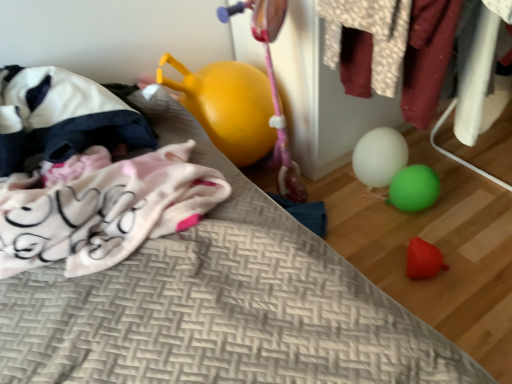
Describe the element at coordinates (61, 117) in the screenshot. This screenshot has width=512, height=384. I see `white fabric bean bag at left` at that location.

In order to face velvet fabric clothes at right, should I rotate leftwards or rightwards?

To align with it, rotate right about 22.116°.

The image size is (512, 384). Find the location of `patterned fabric shirt at upper right`. patterned fabric shirt at upper right is located at coordinates (372, 35).

Locate an element on the screen. This screenshot has width=512, height=384. white fabric bean bag at left is located at coordinates (61, 117).

Considering the sizes of objects white fabric bean bag at left and white matte balloon at center in the image provided, who is smaller, white fabric bean bag at left or white matte balloon at center?

white matte balloon at center.

Considering the relative positions of white fabric bean bag at left and white matte balloon at center in the image provided, is white fabric bean bag at left to the right of white matte balloon at center from the viewer's perspective?

In fact, white fabric bean bag at left is to the left of white matte balloon at center.

Between point (45, 158) and point (391, 157), which one is positioned behind?

Point (391, 157)

Is white fabric bean bag at left aimed at white matte balloon at center?

No, white fabric bean bag at left is not aimed at white matte balloon at center.

The image size is (512, 384). I want to click on closet below the patterned fabric shirt at upper right (from the image's perspective), so click(369, 32).

Is velvet fabric clothes at right to the right of patterned fabric shirt at upper right from the viewer's perspective?

Yes.

Can patterned fabric shirt at upper right be found inside velvet fabric clothes at right?

No, patterned fabric shirt at upper right is located outside of velvet fabric clothes at right.

How far apart are white fabric bean bag at left and patterned fabric shirt at upper right?

They are 29.17 inches apart.

How different are the orientations of white fabric bean bag at left and patterned fabric shirt at upper right in degrees?

1.08 degrees separate the facing orientations of white fabric bean bag at left and patterned fabric shirt at upper right.

From a real-world perspective, which is physically above, white fabric bean bag at left or patterned fabric shirt at upper right?

patterned fabric shirt at upper right.

Is white fabric bean bag at left positioned far away from patterned fabric shirt at upper right?

No, white fabric bean bag at left is in close proximity to patterned fabric shirt at upper right.

You are a GUI agent. You are given a task and a screenshot of the screen. Output one action in this format:
    pyautogui.click(x=<x>, y=<y>)
    Task: Click on the clothing above the white matte balloon at center (from a real-world perspective)
    
    Given the screenshot: What is the action you would take?
    pyautogui.click(x=372, y=35)

Can you tell me how much white matte balloon at center and patterned fabric shirt at upper right differ in facing direction?

They differ by 1.27e-05 degrees in their facing directions.

Is white matte balloon at center further to camera compared to patterned fabric shirt at upper right?

Yes.

Considering the points (367, 139) and (373, 77), which point is in front, point (367, 139) or point (373, 77)?

The point (373, 77) is in front.

In the scene shown: Which is closer to the camera, (73,137) or (468,142)?

Point (73,137) appears to be farther away from the viewer than point (468,142).

Is white fabric bean bag at left in contact with velvet fabric clothes at right?

No, white fabric bean bag at left is not next to velvet fabric clothes at right.

Is white fabric bean bag at left to the left or to the right of velvet fabric clothes at right in the image?

white fabric bean bag at left is positioned on velvet fabric clothes at right's left side.

Looking at the image, does white fabric bean bag at left seem bigger or smaller compared to velvet fabric clothes at right?

Considering their sizes, white fabric bean bag at left takes up more space than velvet fabric clothes at right.

Consider the image. What's the angular difference between velvet fabric clothes at right and white matte balloon at center's facing directions?

The angle between the facing direction of velvet fabric clothes at right and the facing direction of white matte balloon at center is 7.49e-06 degrees.

From a real-world perspective, which object stands above the other?

velvet fabric clothes at right.

Is velvet fabric clothes at right inside the boundaries of white matte balloon at center, or outside?

velvet fabric clothes at right is located beyond the bounds of white matte balloon at center.

From the picture: From the image's perspective, is velvet fabric clothes at right under white matte balloon at center?

No, from the image's perspective, velvet fabric clothes at right is not beneath white matte balloon at center.

Looking at this image, which object is more forward, patterned fabric shirt at upper right or white matte balloon at center?

patterned fabric shirt at upper right.

From their relative heights in the image, would you say patterned fabric shirt at upper right is taller or shorter than white matte balloon at center?

patterned fabric shirt at upper right is taller than white matte balloon at center.

Is patterned fabric shirt at upper right placed right next to white matte balloon at center?

No, patterned fabric shirt at upper right is not touching white matte balloon at center.

Locate an element on the screen. Image resolution: width=512 pixels, height=384 pixels. toy beneath the white fabric bean bag at left (from a real-world perspective) is located at coordinates 394,170.

Identify the location of closet below the patterned fabric shirt at upper right (from the image's perspective). (369, 32).

Which object lies further to the anchor point velvet fabric clothes at right, white matte balloon at center or white fabric bean bag at left?

white fabric bean bag at left lies further to velvet fabric clothes at right than the other object.

From the image, which object appears to be farther from white matte balloon at center, white fabric bean bag at left or velvet fabric clothes at right?

Among the two, white fabric bean bag at left is located further to white matte balloon at center.

In the scene shown: Which object lies further to the anchor point white matte balloon at center, velvet fabric clothes at right or patterned fabric shirt at upper right?

Among the two, patterned fabric shirt at upper right is located further to white matte balloon at center.

Estimate the real-world distances between objects in this image. Which object is closer to white matte balloon at center, white fabric bean bag at left or patterned fabric shirt at upper right?

Among the two, patterned fabric shirt at upper right is located nearer to white matte balloon at center.

Based on their spatial positions, is velvet fabric clothes at right or white fabric bean bag at left closer to patterned fabric shirt at upper right?

velvet fabric clothes at right lies closer to patterned fabric shirt at upper right than the other object.

Considering their positions, is white matte balloon at center positioned closer to patterned fabric shirt at upper right than velvet fabric clothes at right?

Among the two, velvet fabric clothes at right is located nearer to patterned fabric shirt at upper right.

When comparing their distances from white matte balloon at center, does velvet fabric clothes at right or white fabric bean bag at left seem further?

white fabric bean bag at left lies further to white matte balloon at center than the other object.

Looking at the image, which one is located further to white matte balloon at center, patterned fabric shirt at upper right or white fabric bean bag at left?

white fabric bean bag at left.

Locate an element on the screen. The width and height of the screenshot is (512, 384). clothing between white fabric bean bag at left and velvet fabric clothes at right is located at coordinates (372, 35).

Where is `closet situated between white fabric bean bag at left and white matte balloon at center from left to right`? closet situated between white fabric bean bag at left and white matte balloon at center from left to right is located at coordinates (369, 32).

I want to click on clothing between white fabric bean bag at left and white matte balloon at center, so (372, 35).

The width and height of the screenshot is (512, 384). I want to click on closet located between patterned fabric shirt at upper right and white matte balloon at center in the depth direction, so click(369, 32).